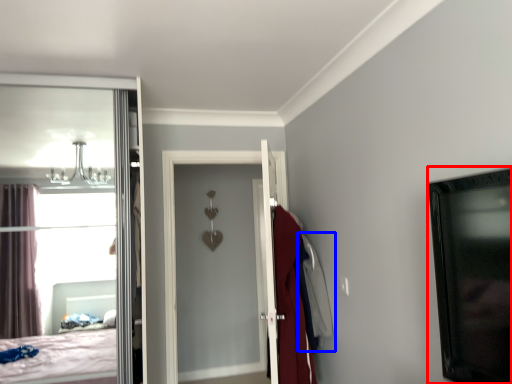
Question: Which of the following is the closest to the observer, picture frame (highlighted by a red box) or robe (highlighted by a blue box)?

Choices:
 (A) picture frame
 (B) robe

Answer: (A)